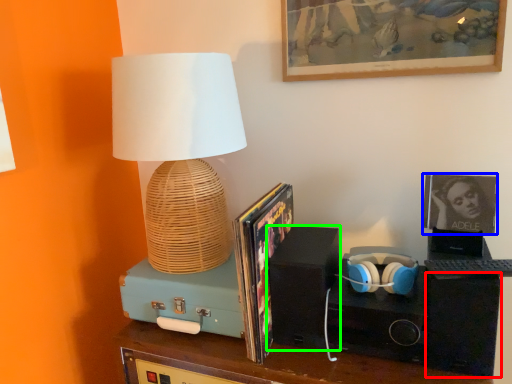
Question: Which object is the closest to the speaker (highlighted by a red box)? Choose among these: picture frame (highlighted by a blue box) or speaker (highlighted by a green box).

Choices:
 (A) picture frame
 (B) speaker

Answer: (A)